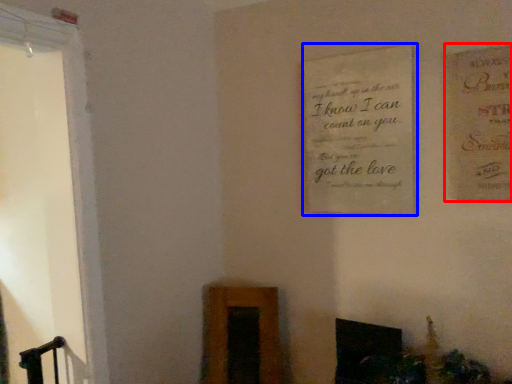
Question: Which object appears closest to the camera in this image, postcard (highlighted by a red box) or plaque (highlighted by a blue box)?

Choices:
 (A) postcard
 (B) plaque

Answer: (A)